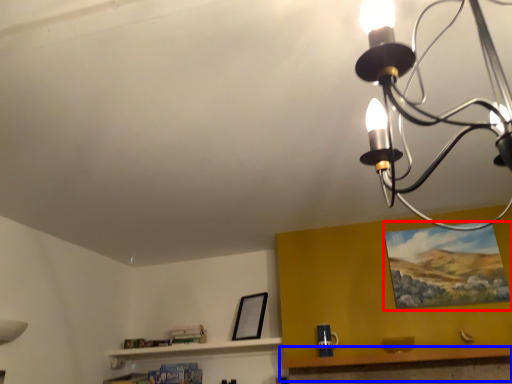
Question: Which point is further to the camera, picture frame (highlighted by a red box) or table (highlighted by a blue box)?

Choices:
 (A) picture frame
 (B) table

Answer: (A)